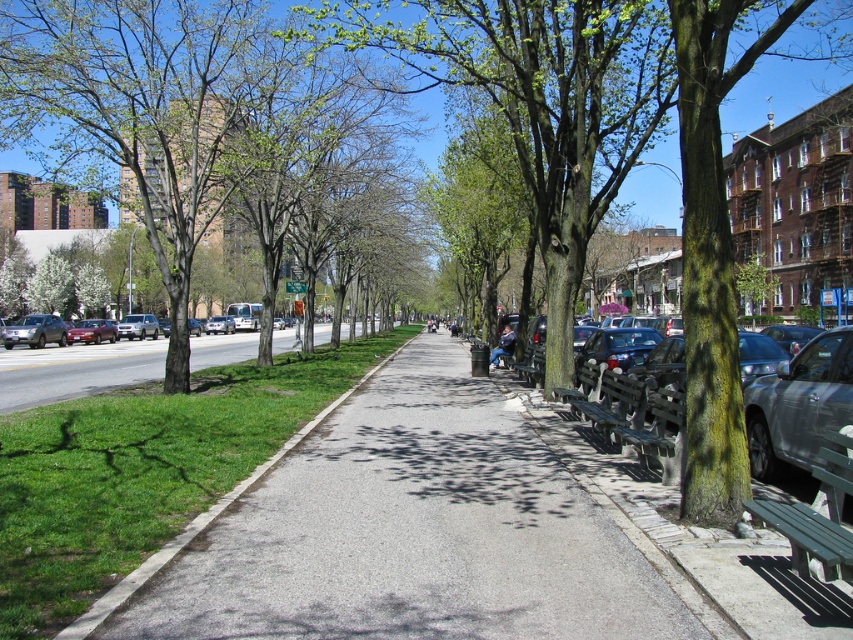
In the scene shown: Between gray asphalt pavement at center and matte black car at left, which one appears on the left side from the viewer's perspective?

matte black car at left is more to the left.

Can you confirm if gray asphalt pavement at center is thinner than matte black car at left?

No, gray asphalt pavement at center is not thinner than matte black car at left.

The image size is (853, 640). In order to click on gray asphalt pavement at center in this screenshot , I will do `click(412, 532)`.

Image resolution: width=853 pixels, height=640 pixels. In order to click on gray asphalt pavement at center in this screenshot , I will do `click(412, 532)`.

Who is taller, wooden park bench at center right or matte red sedan at left?

With more height is matte red sedan at left.

Does point (631, 426) lie behind point (106, 320)?

No, (631, 426) is closer to viewer.

Which is in front, point (621, 394) or point (84, 330)?

Point (621, 394)

Identify the location of wooden park bench at center right. (614, 404).

Does green leafy tree at left appear under wooden park bench at right?

Actually, green leafy tree at left is above wooden park bench at right.

Who is higher up, green leafy tree at left or wooden park bench at right?

green leafy tree at left

Between point (137, 35) and point (651, 432), which one is positioned in front?

Positioned in front is point (651, 432).

Locate an element on the screen. This screenshot has height=640, width=853. green leafy tree at left is located at coordinates (138, 113).